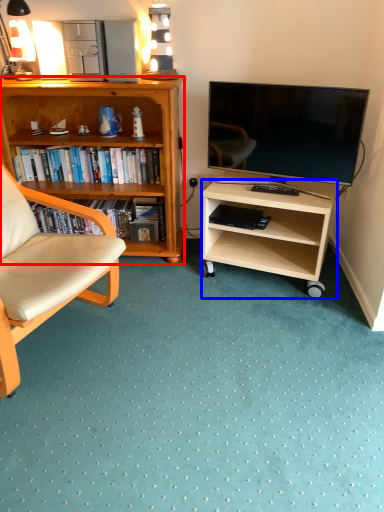
Question: Which point is further to the camera, desk (highlighted by a red box) or desk (highlighted by a blue box)?

Choices:
 (A) desk
 (B) desk

Answer: (A)